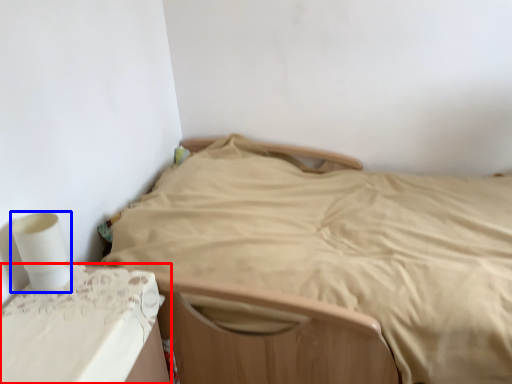
Question: Which of the following is the closest to the observer, furniture (highlighted by a red box) or toilet paper (highlighted by a blue box)?

Choices:
 (A) furniture
 (B) toilet paper

Answer: (A)